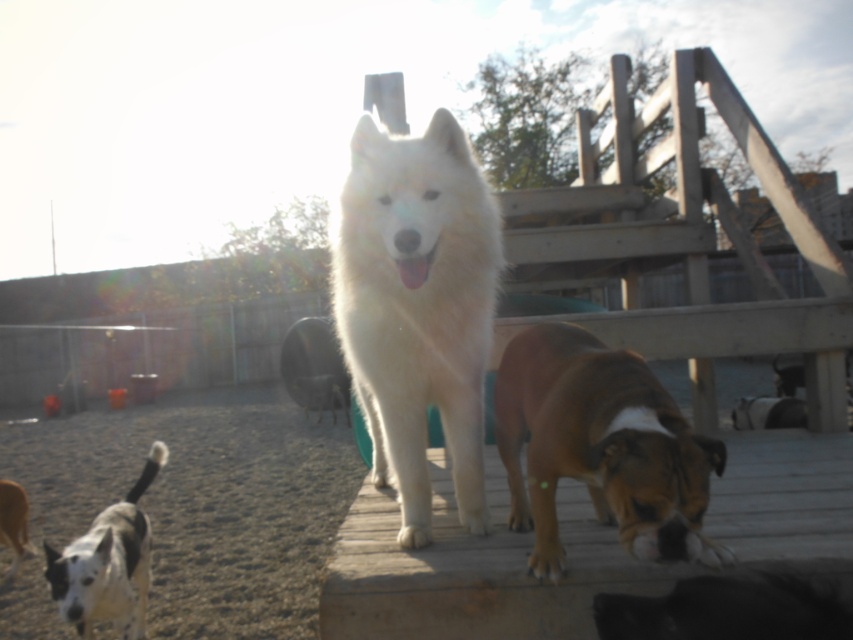
Question: Which object is closer to the camera taking this photo?

Choices:
 (A) spotted fur dog at lower left
 (B) wooden deck at center
 (C) white fluffy dog at center
 (D) brown matte dog at center

Answer: (D)

Question: Observing the image, what is the correct spatial positioning of brown matte dog at center in reference to spotted fur dog at lower left?

Choices:
 (A) above
 (B) below

Answer: (A)

Question: Estimate the real-world distances between objects in this image. Which object is farther from the wooden deck at center?

Choices:
 (A) white fluffy dog at center
 (B) brown matte dog at center

Answer: (A)

Question: Where is spotted fur dog at lower left located in relation to white fluffy dog at lower left in the image?

Choices:
 (A) below
 (B) above

Answer: (B)

Question: Which point is closer to the camera taking this photo?

Choices:
 (A) (386, 472)
 (B) (16, 493)
 (C) (552, 392)
 (D) (140, 522)

Answer: (C)

Question: Where is brown matte dog at center located in relation to spotted fur dog at lower left in the image?

Choices:
 (A) above
 (B) below

Answer: (A)